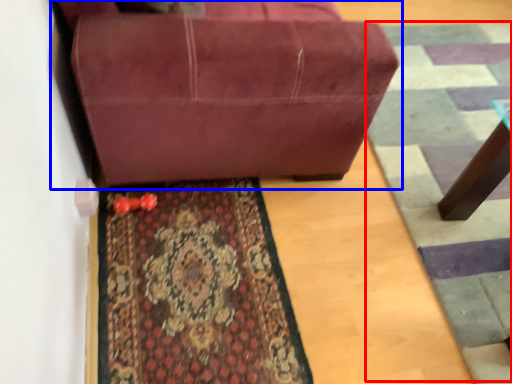
Question: Which of the following is the closest to the observer, doormat (highlighted by a red box) or studio couch (highlighted by a blue box)?

Choices:
 (A) doormat
 (B) studio couch

Answer: (B)